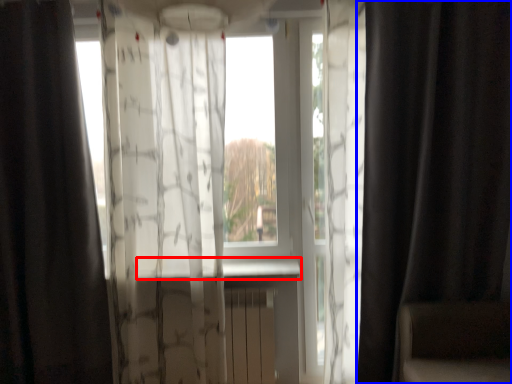
Question: Which object appears farthest to the camera in this image, window sill (highlighted by a red box) or curtain (highlighted by a blue box)?

Choices:
 (A) window sill
 (B) curtain

Answer: (A)